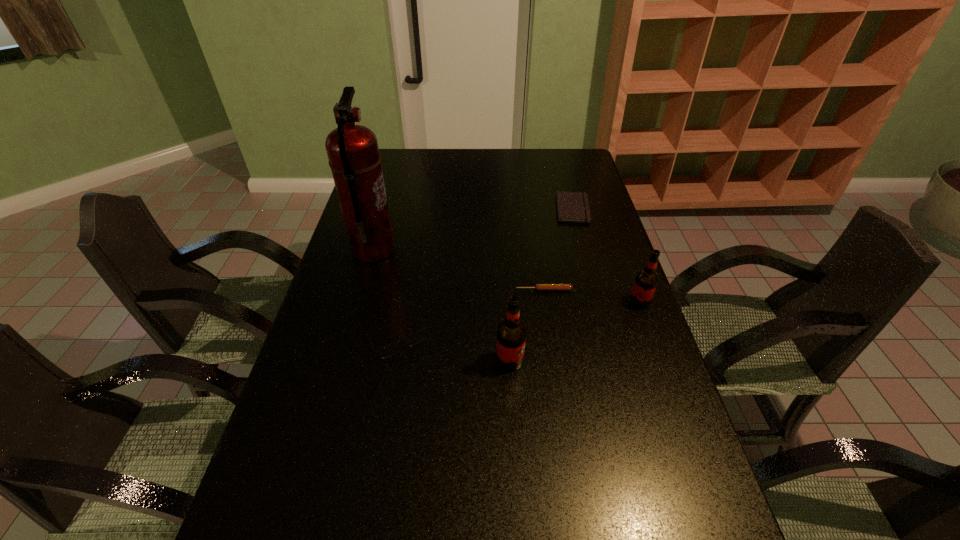
Find the location of a particular element. This screenshot has width=960, height=540. checkbook at the right edge is located at coordinates (573, 207).

At what (x,y) coordinates should I click in order to perform the action: click on free space at the far edge of the desktop. Please return your answer as a coordinate pair (x, y). Image resolution: width=960 pixels, height=540 pixels. Looking at the image, I should click on (539, 148).

Locate an element on the screen. The width and height of the screenshot is (960, 540). free space at the near edge is located at coordinates (563, 508).

Locate an element on the screen. This screenshot has width=960, height=540. free space at the left edge is located at coordinates (337, 289).

In the image, there is a desktop. Identify the location of free space at the right edge. (601, 342).

Locate an element on the screen. Image resolution: width=960 pixels, height=540 pixels. vacant space at the far left corner of the desktop is located at coordinates (386, 172).

The width and height of the screenshot is (960, 540). What are the coordinates of `vacant space at the near left corner of the desktop` in the screenshot? It's located at coord(250,531).

This screenshot has width=960, height=540. I want to click on free region at the far right corner, so click(x=575, y=152).

Where is `free location at the near right corner of the desktop`? Image resolution: width=960 pixels, height=540 pixels. free location at the near right corner of the desktop is located at coordinates (680, 507).

The image size is (960, 540). Identify the location of empty location between the fifth tallest object and the spectacles. (471, 314).